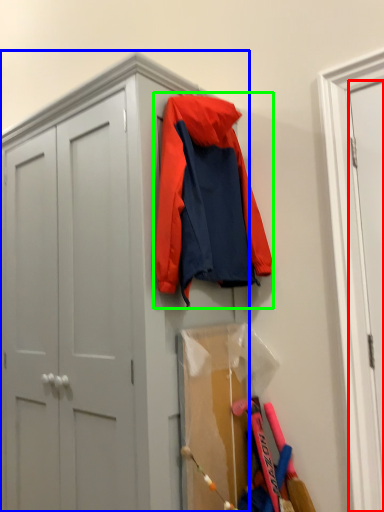
Question: Estimate the real-world distances between objects in this image. Which object is closer to door (highlighted by a red box), cabinetry (highlighted by a blue box) or jacket (highlighted by a green box)?

Choices:
 (A) cabinetry
 (B) jacket

Answer: (B)